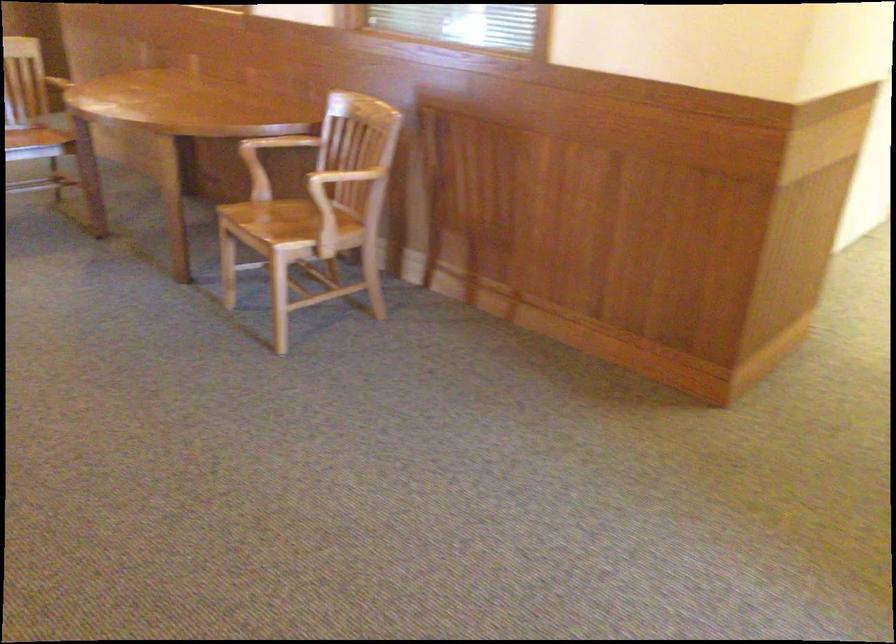
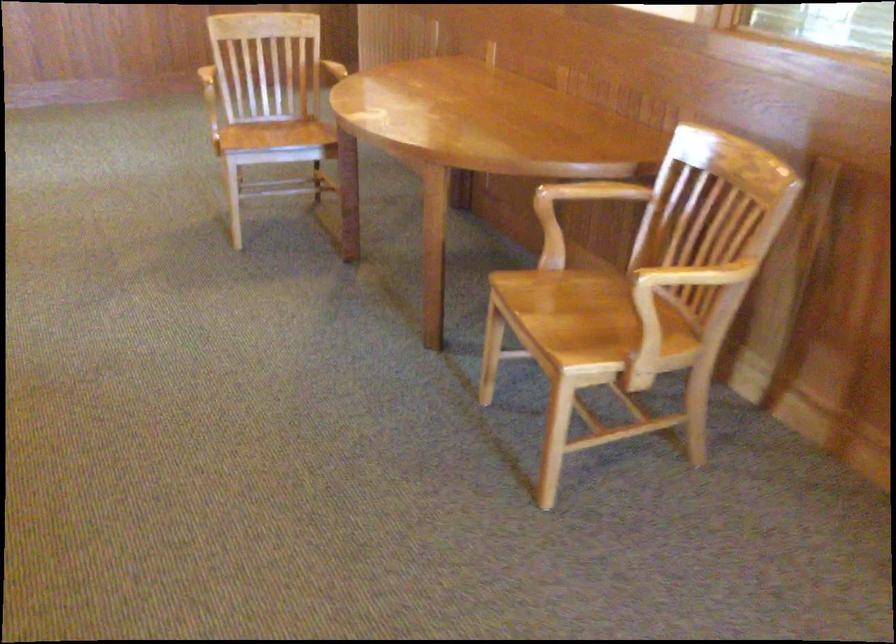
Locate, in the second image, the point that corresponds to (282,213) in the first image.

(583, 301)